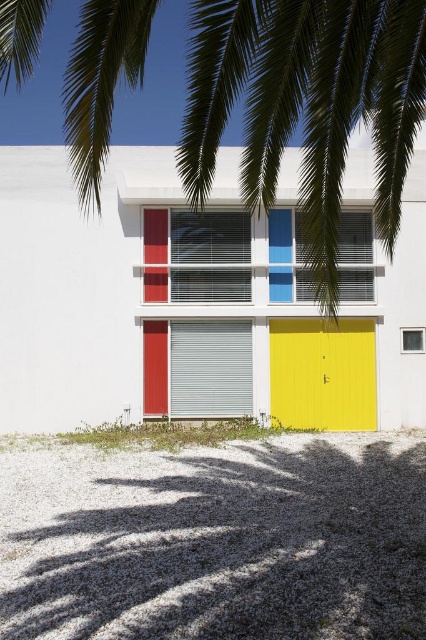
Question: Which is farther from the matte gray shutter at center?

Choices:
 (A) green leafy palm tree at upper center
 (B) white matte shutter at center

Answer: (A)

Question: Considering the real-world distances, which object is farthest from the matte gray shutter at center?

Choices:
 (A) yellow matte door at center
 (B) blue matte shutter at center
 (C) green leafy palm tree at upper center

Answer: (C)

Question: Can you confirm if yellow matte door at center is wider than white matte shutter at center?

Choices:
 (A) yes
 (B) no

Answer: (A)

Question: Which object is farther from the camera taking this photo?

Choices:
 (A) blue matte shutter at center
 (B) yellow matte door at center

Answer: (A)

Question: Does white matte shutter at center have a lesser width compared to blue matte shutter at center?

Choices:
 (A) yes
 (B) no

Answer: (B)

Question: Does green leafy palm tree at upper center appear under white plastic shutter at center?

Choices:
 (A) no
 (B) yes

Answer: (A)